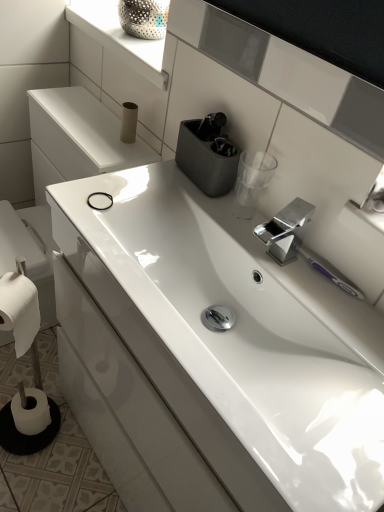
In order to click on blank space to the left of matte cardboard toilet paper at upper center, the first toilet paper viewed from the right in this screenshot , I will do `click(86, 126)`.